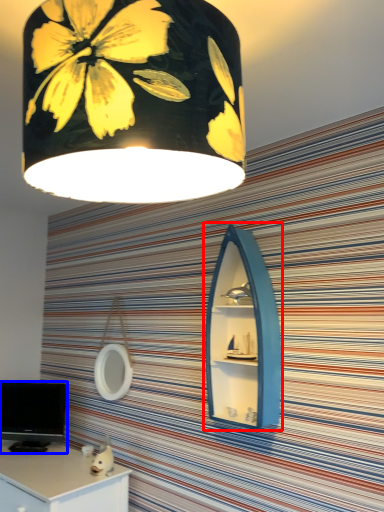
Question: Which point is closer to the camera, medicine cabinet (highlighted by a red box) or computer monitor (highlighted by a blue box)?

Choices:
 (A) medicine cabinet
 (B) computer monitor

Answer: (A)